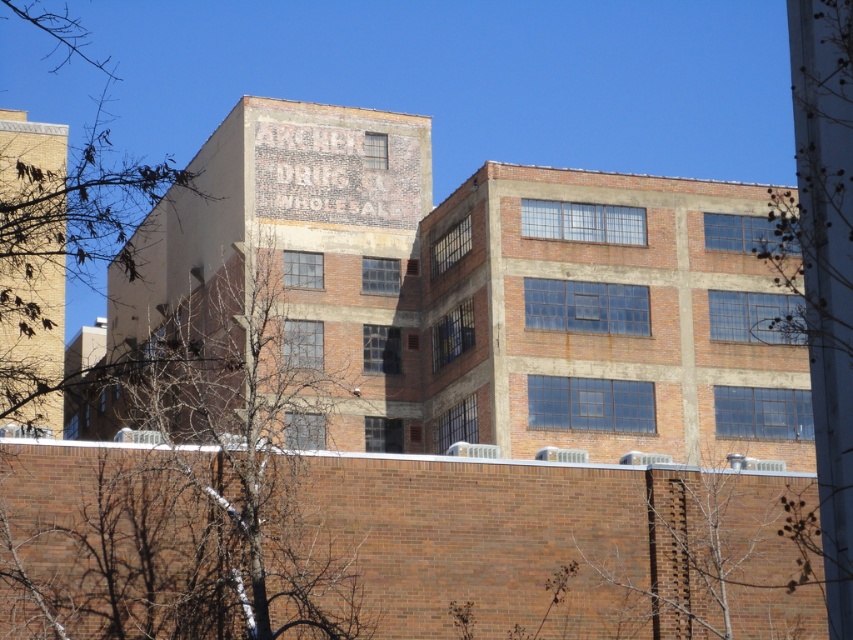
Question: Does brown textured tree at lower right lie behind bare branches at right?

Choices:
 (A) yes
 (B) no

Answer: (A)

Question: Which is nearer to the bare branches at right?

Choices:
 (A) bare branches at center
 (B) brown textured tree at lower right

Answer: (B)

Question: Which object is closer to the camera taking this photo?

Choices:
 (A) brown textured tree at lower right
 (B) bare branches at right

Answer: (B)

Question: Observing the image, what is the correct spatial positioning of brown textured tree at lower right in reference to bare branches at right?

Choices:
 (A) below
 (B) above

Answer: (A)

Question: Is bare branches at center further to the viewer compared to bare branches at right?

Choices:
 (A) yes
 (B) no

Answer: (A)

Question: Which point is closer to the camera taking this photo?

Choices:
 (A) (241, 580)
 (B) (805, 236)

Answer: (B)